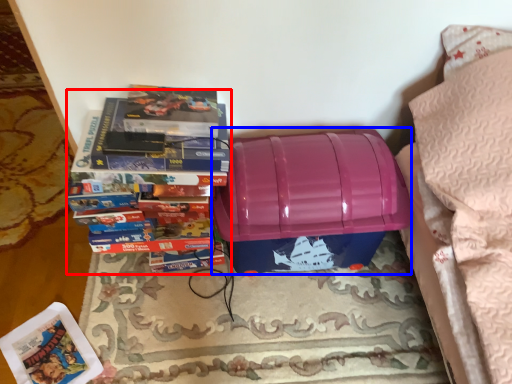
Question: Which point is further to the camera, book (highlighted by a red box) or storage box (highlighted by a blue box)?

Choices:
 (A) book
 (B) storage box

Answer: (B)